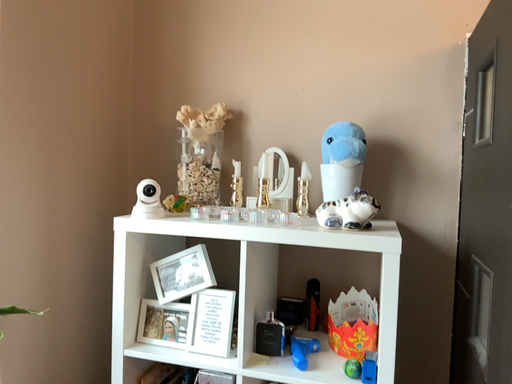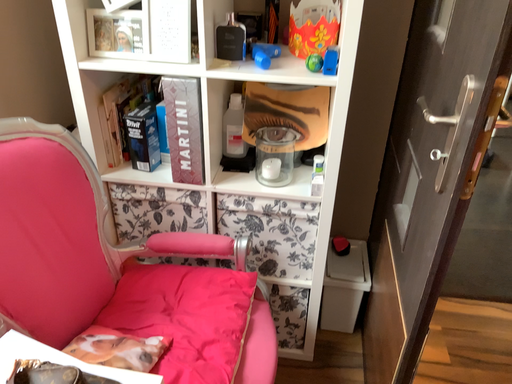
Question: How did the camera likely rotate when shooting the video?

Choices:
 (A) rotated upward
 (B) rotated downward

Answer: (B)